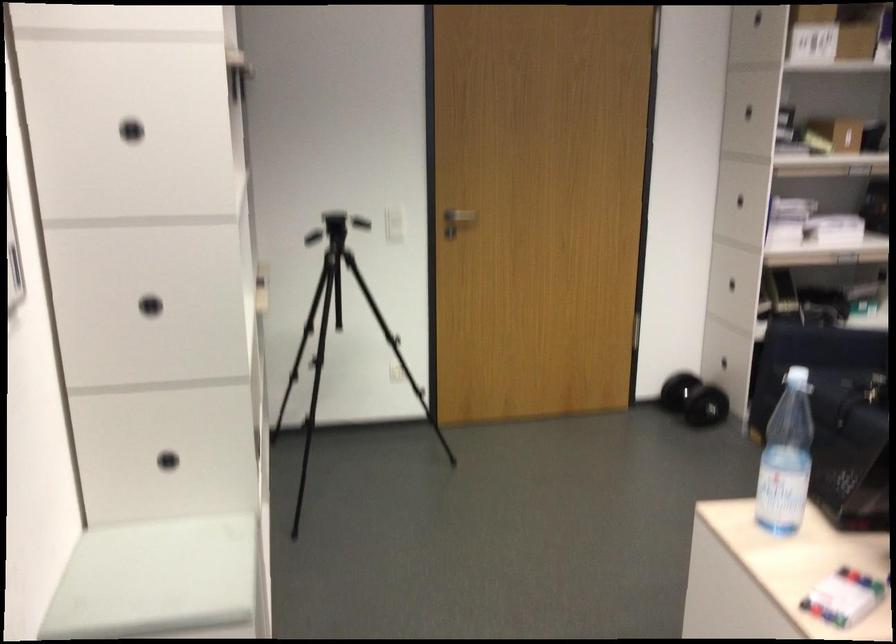
Where would you lift the plastic water bottle? Please return your answer as a coordinate pair (x, y).

(786, 458)